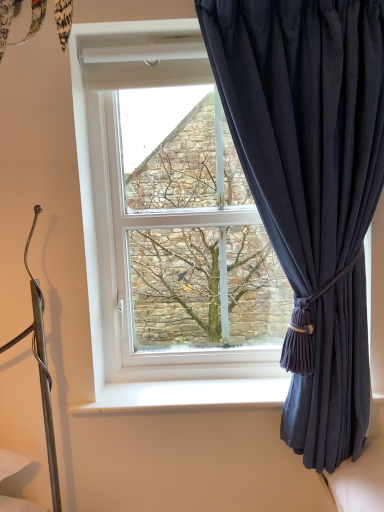
Question: Does green textured tree at center have a smaller size compared to white plastic window sill at lower center?

Choices:
 (A) no
 (B) yes

Answer: (A)

Question: Does green textured tree at center have a lesser height compared to white plastic window sill at lower center?

Choices:
 (A) no
 (B) yes

Answer: (A)

Question: Could you tell me if green textured tree at center is facing white plastic window sill at lower center?

Choices:
 (A) no
 (B) yes

Answer: (B)

Question: Considering the relative sizes of green textured tree at center and white plastic window sill at lower center in the image provided, is green textured tree at center bigger than white plastic window sill at lower center?

Choices:
 (A) yes
 (B) no

Answer: (A)

Question: Can you see green textured tree at center touching white plastic window sill at lower center?

Choices:
 (A) no
 (B) yes

Answer: (A)

Question: From a real-world perspective, is green textured tree at center under white plastic window sill at lower center?

Choices:
 (A) no
 (B) yes

Answer: (A)

Question: Can you confirm if white plastic window sill at lower center is shorter than green textured tree at center?

Choices:
 (A) yes
 (B) no

Answer: (A)

Question: Are white plastic window sill at lower center and green textured tree at center far apart?

Choices:
 (A) yes
 (B) no

Answer: (B)

Question: Does white plastic window sill at lower center have a greater width compared to green textured tree at center?

Choices:
 (A) no
 (B) yes

Answer: (B)

Question: Is green textured tree at center at the back of white plastic window sill at lower center?

Choices:
 (A) no
 (B) yes

Answer: (A)

Question: Can you confirm if white plastic window sill at lower center is thinner than green textured tree at center?

Choices:
 (A) yes
 (B) no

Answer: (B)

Question: Considering the relative positions of white plastic window sill at lower center and green textured tree at center in the image provided, is white plastic window sill at lower center to the right of green textured tree at center from the viewer's perspective?

Choices:
 (A) no
 (B) yes

Answer: (B)

Question: Can you confirm if white plastic window sill at lower center is smaller than dark blue fabric curtain at right?

Choices:
 (A) no
 (B) yes

Answer: (B)